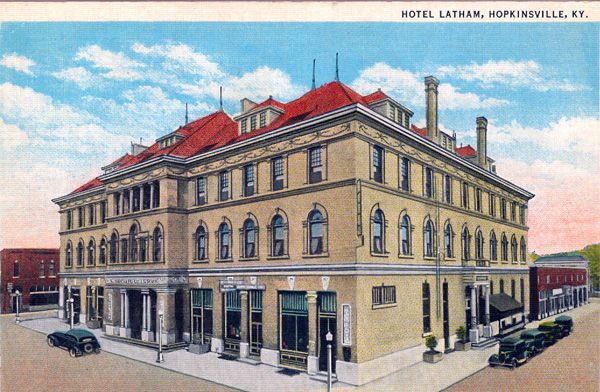
Find the location of a particular element. hotel is located at coordinates (205, 215).